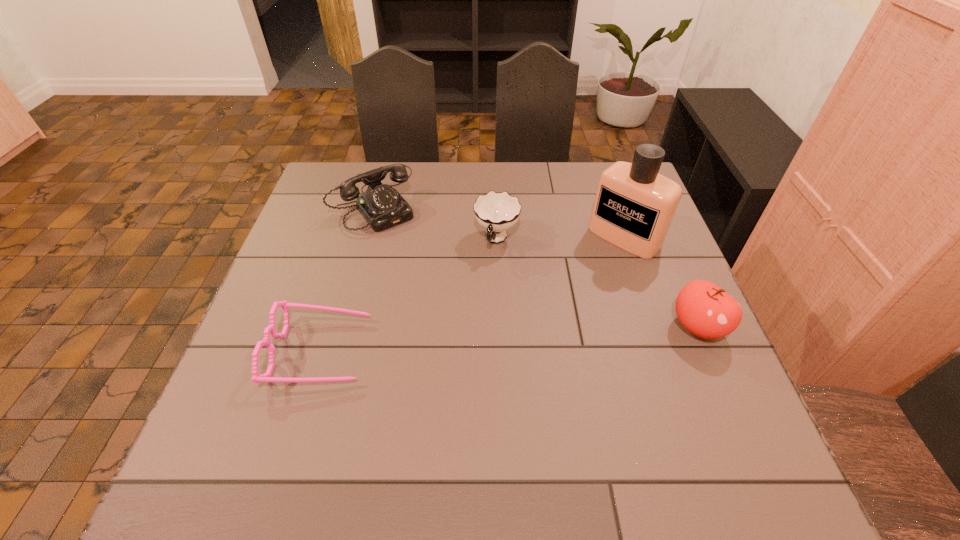
The image size is (960, 540). What are the coordinates of `vacant region located on the side of the third object from left to right with the handle` in the screenshot? It's located at (468, 331).

Locate an element on the screen. The image size is (960, 540). free region located 0.380m on the side of the third object from left to right with the handle is located at coordinates (449, 385).

Where is `free space located on the side of the third object from left to right with the handle`? free space located on the side of the third object from left to right with the handle is located at coordinates (452, 377).

Where is `free region located 0.400m on the front-facing side of the telephone`? This screenshot has height=540, width=960. free region located 0.400m on the front-facing side of the telephone is located at coordinates 469,321.

Where is `blank space located on the front-facing side of the telephone`? blank space located on the front-facing side of the telephone is located at coordinates (441, 286).

Image resolution: width=960 pixels, height=540 pixels. Find the location of `vacant space situated 0.080m on the front-facing side of the telephone`. vacant space situated 0.080m on the front-facing side of the telephone is located at coordinates (406, 242).

You are a GUI agent. You are given a task and a screenshot of the screen. Output one action in this format:
    pyautogui.click(x=<x>, y=<y>)
    Task: Click on the object present at the far edge
    The width and height of the screenshot is (960, 540).
    Given the screenshot: What is the action you would take?
    pyautogui.click(x=382, y=206)

This screenshot has width=960, height=540. What are the coordinates of `object positioned at the near edge` in the screenshot? It's located at (266, 377).

Identify the location of spectacles present at the left edge. (266, 377).

Identify the location of telephone present at the left edge. (382, 206).